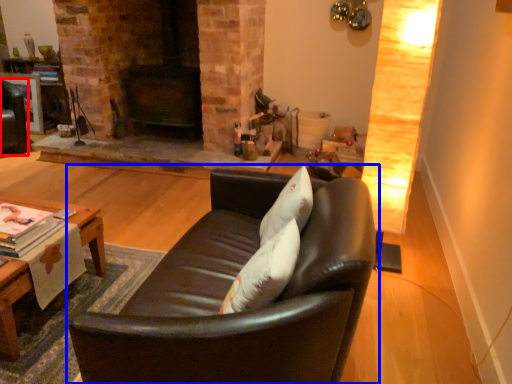
Question: Which of the following is the closest to the observer, swivel chair (highlighted by a red box) or studio couch (highlighted by a blue box)?

Choices:
 (A) swivel chair
 (B) studio couch

Answer: (B)